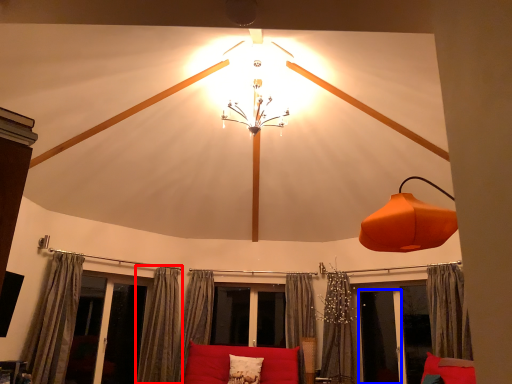
Question: Which object is closer to the camera taking this photo, curtain (highlighted by a red box) or screen door (highlighted by a blue box)?

Choices:
 (A) curtain
 (B) screen door

Answer: (A)